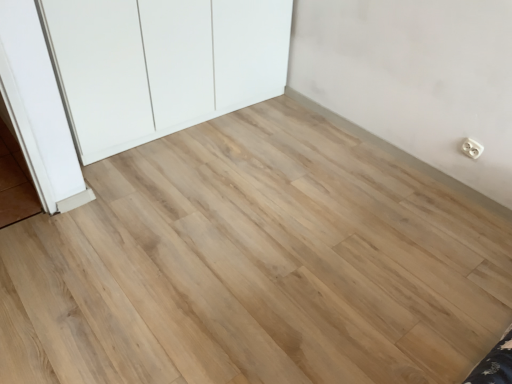
At what (x,y) coordinates should I click in order to perform the action: click on white matte door at upper left. Please return your answer as a coordinate pair (x, y). Image resolution: width=512 pixels, height=384 pixels. Looking at the image, I should click on (162, 64).

The width and height of the screenshot is (512, 384). Describe the element at coordinates (162, 64) in the screenshot. I see `white matte door at upper left` at that location.

You are a GUI agent. You are given a task and a screenshot of the screen. Output one action in this format:
    pyautogui.click(x=<x>, y=<y>)
    Task: Click on the white matte door at upper left
    
    Given the screenshot: What is the action you would take?
    pyautogui.click(x=162, y=64)